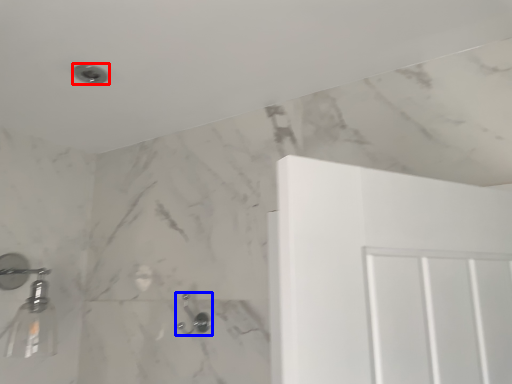
Question: Which point is further to the camera, shower (highlighted by a red box) or shower (highlighted by a blue box)?

Choices:
 (A) shower
 (B) shower

Answer: (B)